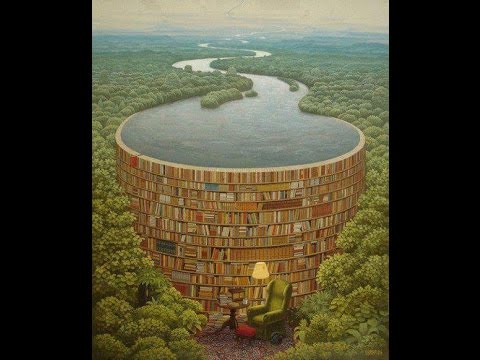
You are a GUI agent. You are given a task and a screenshot of the screen. Output one action in this format:
    pyautogui.click(x=<x>, y=<y>)
    Task: Click on the bookshelf
    The width and height of the screenshot is (480, 360).
    Given the screenshot: What is the action you would take?
    pyautogui.click(x=218, y=237)